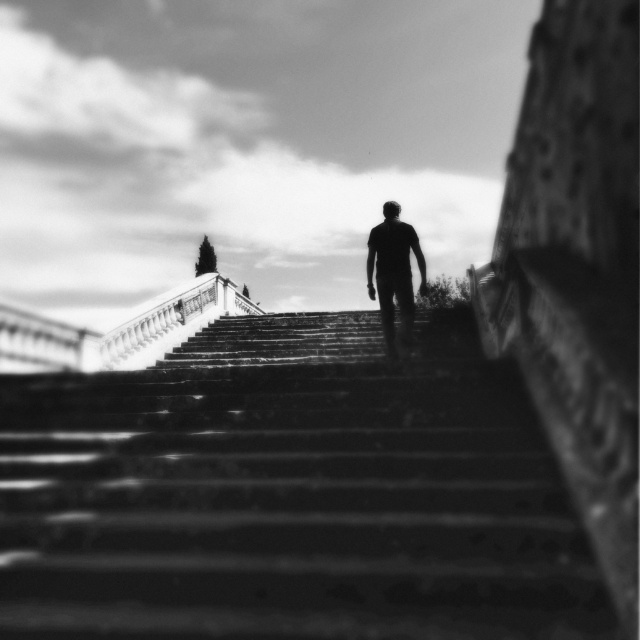
You are standing at the bottom of the stairs and see the silhouette figure at center and the smooth stone stairs at center. Which object is closer to you?

The smooth stone stairs at center are closer to you because they are positioned below the silhouette figure at center.

You are standing at the bottom of the smooth stone stairs at center and want to reach the silhouette figure at center who is higher up. How does the height of the stairs compare to the figure?

The smooth stone stairs at center are not as tall as the silhouette figure at center, so the figure is taller than the stairs.